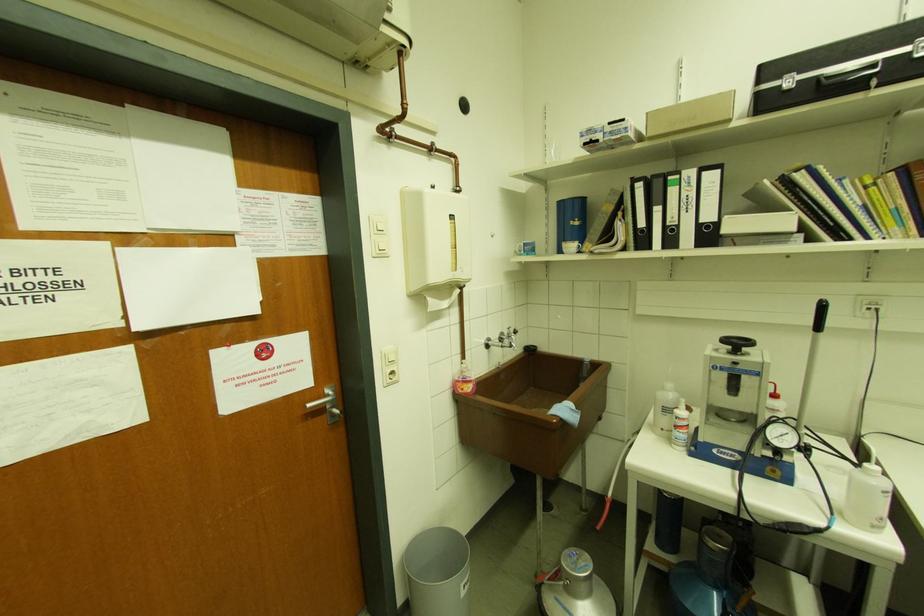
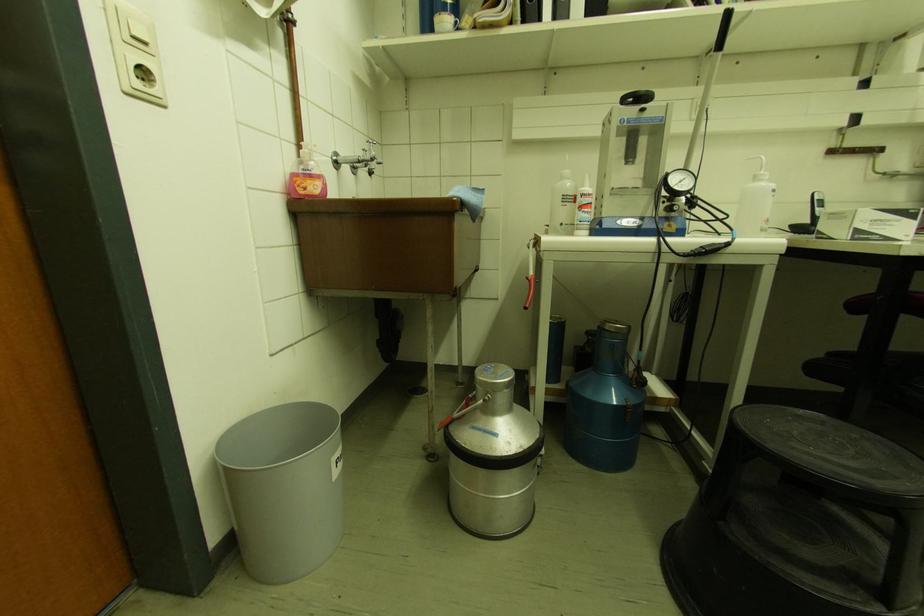
Locate, in the second image, the point that corresponds to (x=396, y=363) in the first image.

(149, 45)